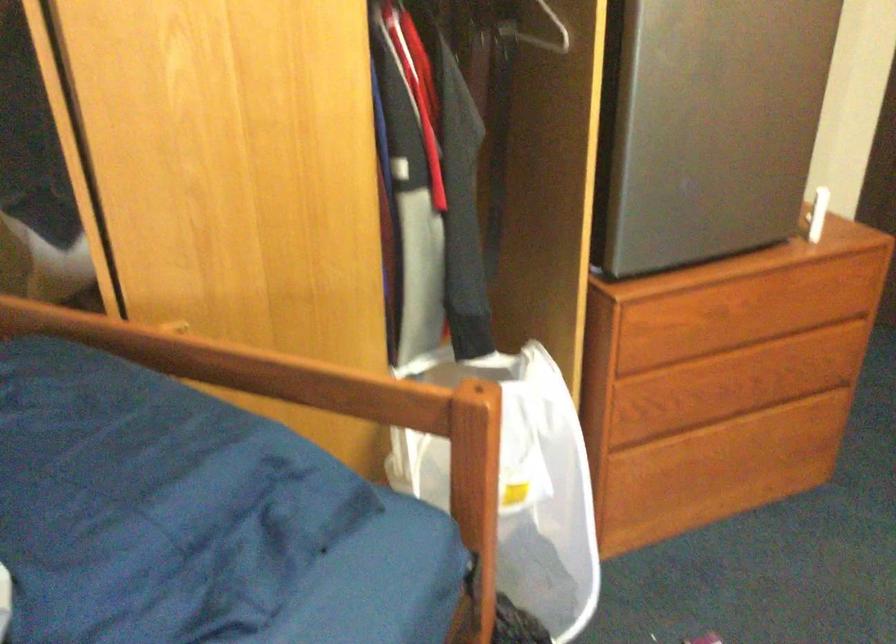
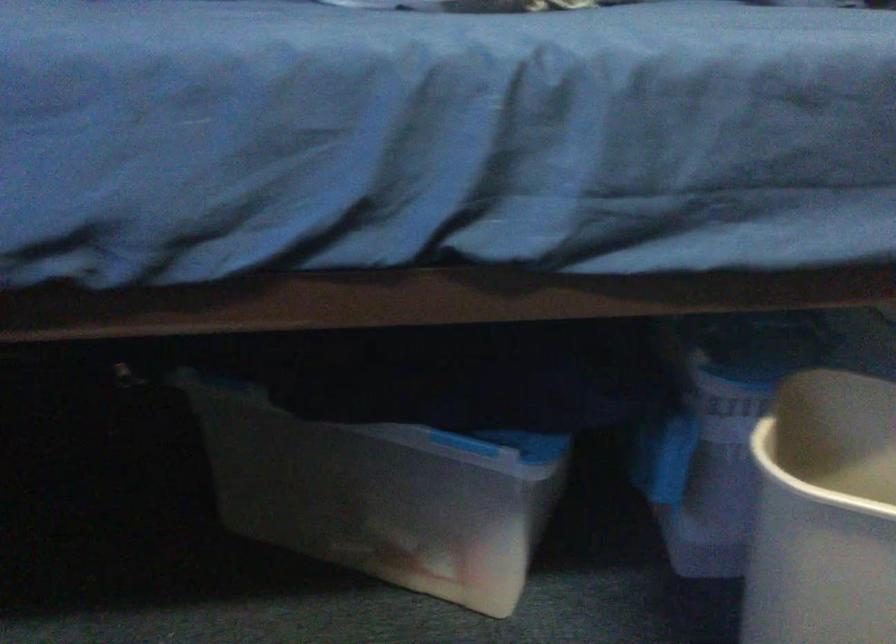
Question: Based on the continuous images, in which direction is the camera rotating? Reply with the corresponding letter.

Choices:
 (A) Left
 (B) Right
 (C) Up
 (D) Down

Answer: (A)